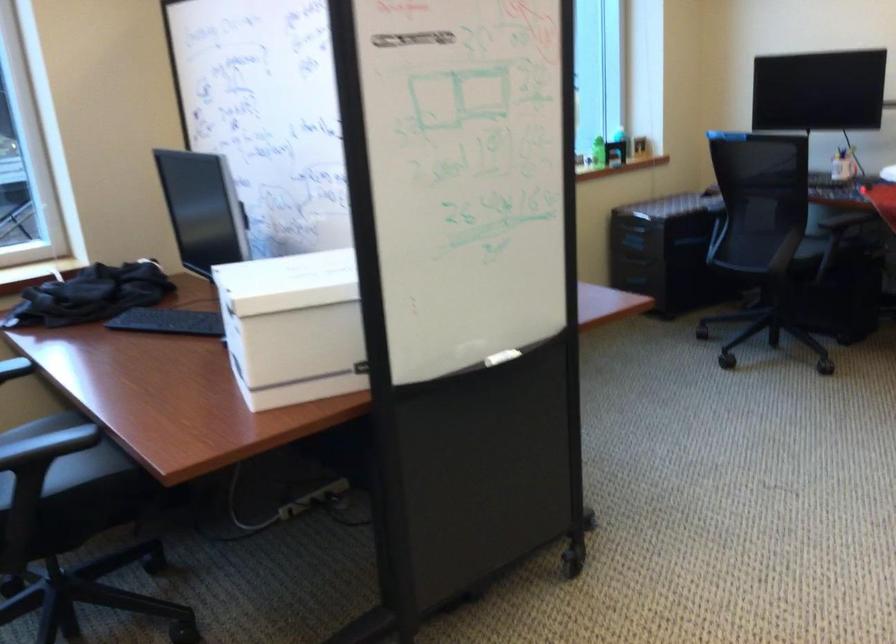
What do you see at coordinates (630, 228) in the screenshot? I see `the cabinet drawer handle` at bounding box center [630, 228].